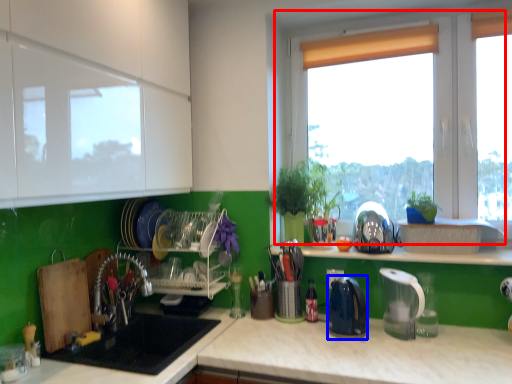
Question: Among these objects, which one is farthest to the camera, window (highlighted by a red box) or kitchen appliance (highlighted by a blue box)?

Choices:
 (A) window
 (B) kitchen appliance

Answer: (A)